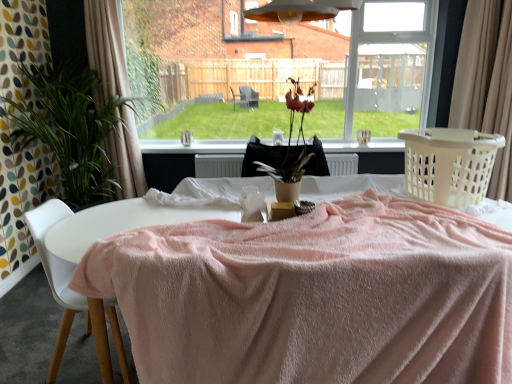
Question: Is beige fabric curtain at left, the second curtain when ordered from right to left, oriented towards white plastic chair at lower left?

Choices:
 (A) yes
 (B) no

Answer: (A)

Question: Considering the relative sizes of beige fabric curtain at left, the second curtain when ordered from right to left, and white plastic chair at lower left in the image provided, is beige fabric curtain at left, the second curtain when ordered from right to left, shorter than white plastic chair at lower left?

Choices:
 (A) yes
 (B) no

Answer: (B)

Question: Is beige fabric curtain at left, the second curtain when ordered from right to left, surrounding white plastic chair at lower left?

Choices:
 (A) yes
 (B) no

Answer: (B)

Question: Is the surface of beige fabric curtain at left, placed as the first curtain when sorted from left to right, in direct contact with white plastic chair at lower left?

Choices:
 (A) no
 (B) yes

Answer: (A)

Question: Considering the relative sizes of beige fabric curtain at left, the second curtain when ordered from right to left, and white plastic chair at lower left in the image provided, is beige fabric curtain at left, the second curtain when ordered from right to left, thinner than white plastic chair at lower left?

Choices:
 (A) no
 (B) yes

Answer: (B)

Question: Can you confirm if beige fabric curtain at left, placed as the first curtain when sorted from left to right, is positioned to the right of white plastic chair at lower left?

Choices:
 (A) no
 (B) yes

Answer: (A)

Question: Considering the relative sizes of white plastic chair at lower left and black fabric at center in the image provided, is white plastic chair at lower left shorter than black fabric at center?

Choices:
 (A) yes
 (B) no

Answer: (B)

Question: Does white plastic chair at lower left have a smaller size compared to black fabric at center?

Choices:
 (A) no
 (B) yes

Answer: (A)

Question: Is black fabric at center at the back of white plastic chair at lower left?

Choices:
 (A) no
 (B) yes

Answer: (A)

Question: Is white plastic chair at lower left facing towards black fabric at center?

Choices:
 (A) yes
 (B) no

Answer: (B)

Question: Is the position of white plastic chair at lower left more distant than that of black fabric at center?

Choices:
 (A) no
 (B) yes

Answer: (A)

Question: Is white plastic chair at lower left in front of black fabric at center?

Choices:
 (A) no
 (B) yes

Answer: (B)

Question: Are black fabric at center and beige fabric curtain at left, the second curtain when ordered from right to left, making contact?

Choices:
 (A) yes
 (B) no

Answer: (B)